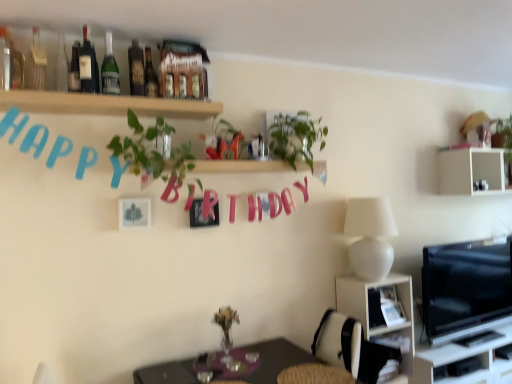
Question: In which direction should I rotate to look at shiny dark glass bottle at upper center, placed as the 1th bottle when sorted from right to left?

Choices:
 (A) left
 (B) right

Answer: (A)

Question: From the image's perspective, would you say matte black tv stand at right, marked as the 1th shelf in a bottom-to-top arrangement, is shown under white matte shelf at upper right, which ranks as the 1th shelf in right-to-left order?

Choices:
 (A) yes
 (B) no

Answer: (A)

Question: Does matte black tv stand at right, acting as the third shelf starting from the left, contain white matte shelf at upper right, which ranks as the 4th shelf in left-to-right order?

Choices:
 (A) yes
 (B) no

Answer: (B)

Question: From the image's perspective, is matte black tv stand at right, acting as the third shelf starting from the left, above white matte shelf at upper right, which ranks as the 1th shelf in right-to-left order?

Choices:
 (A) no
 (B) yes

Answer: (A)

Question: Is matte black tv stand at right, which is the second shelf in right-to-left order, to the right of white matte shelf at upper right, positioned as the 2th shelf in top-to-bottom order, from the viewer's perspective?

Choices:
 (A) no
 (B) yes

Answer: (A)

Question: From a real-world perspective, is matte black tv stand at right, which is the second shelf in right-to-left order, below white matte shelf at upper right, positioned as the 2th shelf in top-to-bottom order?

Choices:
 (A) no
 (B) yes

Answer: (B)

Question: From a real-world perspective, is matte black tv stand at right, which is the second shelf in right-to-left order, on top of white matte shelf at upper right, which ranks as the 1th shelf in right-to-left order?

Choices:
 (A) no
 (B) yes

Answer: (A)

Question: Are shiny dark glass bottle at upper center, which is counted as the eighth bottle, starting from the left, and wooden table at lower center beside each other?

Choices:
 (A) yes
 (B) no

Answer: (B)

Question: From the image's perspective, is shiny dark glass bottle at upper center, placed as the 1th bottle when sorted from right to left, above wooden table at lower center?

Choices:
 (A) no
 (B) yes

Answer: (B)

Question: Considering the relative sizes of shiny dark glass bottle at upper center, which is counted as the eighth bottle, starting from the left, and wooden table at lower center in the image provided, is shiny dark glass bottle at upper center, which is counted as the eighth bottle, starting from the left, wider than wooden table at lower center?

Choices:
 (A) yes
 (B) no

Answer: (B)

Question: Can you confirm if shiny dark glass bottle at upper center, placed as the 1th bottle when sorted from right to left, is smaller than wooden table at lower center?

Choices:
 (A) yes
 (B) no

Answer: (A)

Question: Is shiny dark glass bottle at upper center, which is counted as the eighth bottle, starting from the left, thinner than wooden table at lower center?

Choices:
 (A) yes
 (B) no

Answer: (A)

Question: Does shiny dark glass bottle at upper center, which is counted as the eighth bottle, starting from the left, come behind wooden table at lower center?

Choices:
 (A) no
 (B) yes

Answer: (B)

Question: Considering the relative sizes of clear glass bottle at upper left, the 7th bottle when ordered from right to left, and green leafy plant at upper center in the image provided, is clear glass bottle at upper left, the 7th bottle when ordered from right to left, wider than green leafy plant at upper center?

Choices:
 (A) yes
 (B) no

Answer: (B)